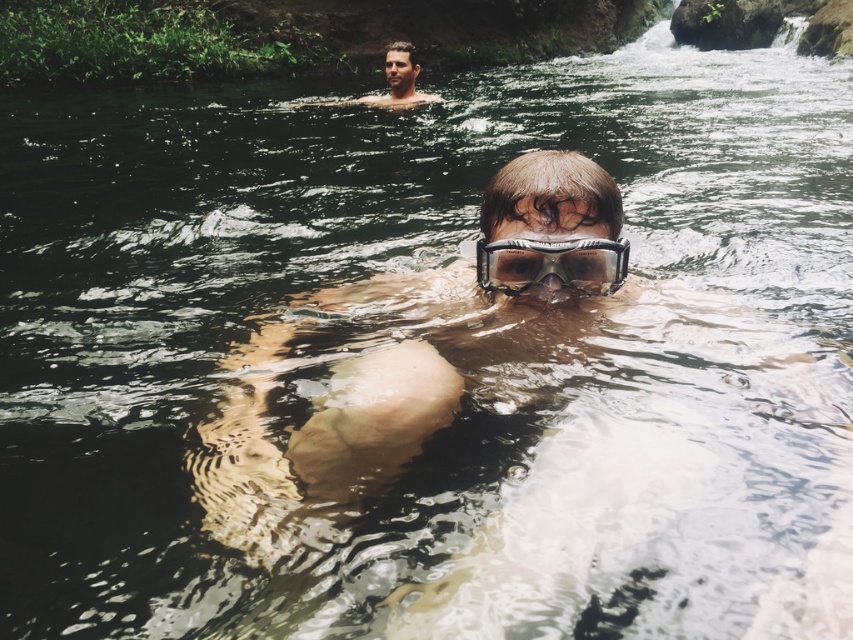
Which is in front, point (497, 243) or point (396, 81)?

Point (497, 243) is in front.

Locate an element on the screen. This screenshot has width=853, height=640. transparent plastic goggles at center is located at coordinates (550, 264).

Can you confirm if clear plastic goggles at center is wider than smooth skin man at upper center?

Indeed, clear plastic goggles at center has a greater width compared to smooth skin man at upper center.

In the scene shown: Is clear plastic goggles at center to the left of smooth skin man at upper center from the viewer's perspective?

No, clear plastic goggles at center is not to the left of smooth skin man at upper center.

Which is behind, point (543, 228) or point (396, 88)?

The point (396, 88) is more distant.

Where is `clear plastic goggles at center`? clear plastic goggles at center is located at coordinates (409, 355).

From the picture: Which is below, clear plastic goggles at center or transparent plastic goggles at center?

clear plastic goggles at center is lower down.

Who is more distant from viewer, [465,262] or [555,246]?

The point [465,262] is behind.

The height and width of the screenshot is (640, 853). What do you see at coordinates (409, 355) in the screenshot?
I see `clear plastic goggles at center` at bounding box center [409, 355].

At what (x,y) coordinates should I click in order to perform the action: click on clear plastic goggles at center. Please return your answer as a coordinate pair (x, y). The width and height of the screenshot is (853, 640). Looking at the image, I should click on (409, 355).